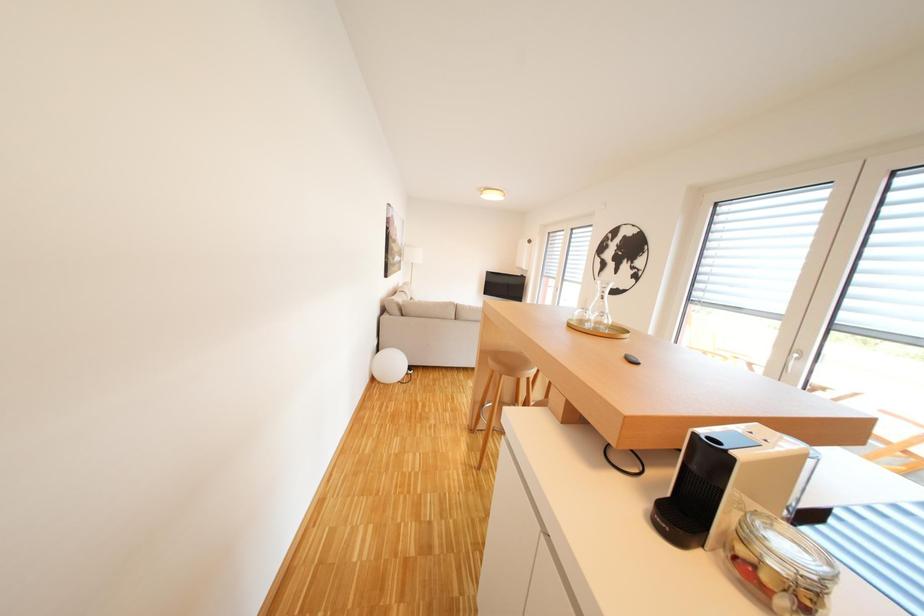
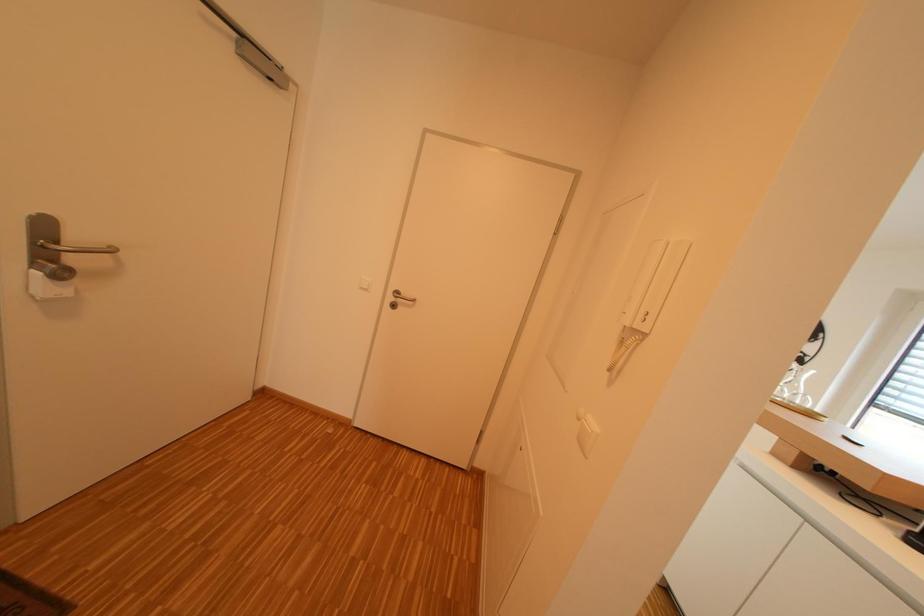
Looking at this image, the images are taken continuously from a first-person perspective. In which direction are you moving?

The cameraman walked toward left, backward.